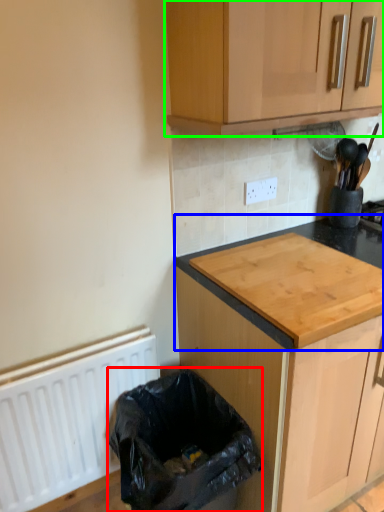
Question: Which object is the farthest from recycling bin (highlighted by a red box)? Choose among these: countertop (highlighted by a blue box) or cabinetry (highlighted by a green box).

Choices:
 (A) countertop
 (B) cabinetry

Answer: (B)